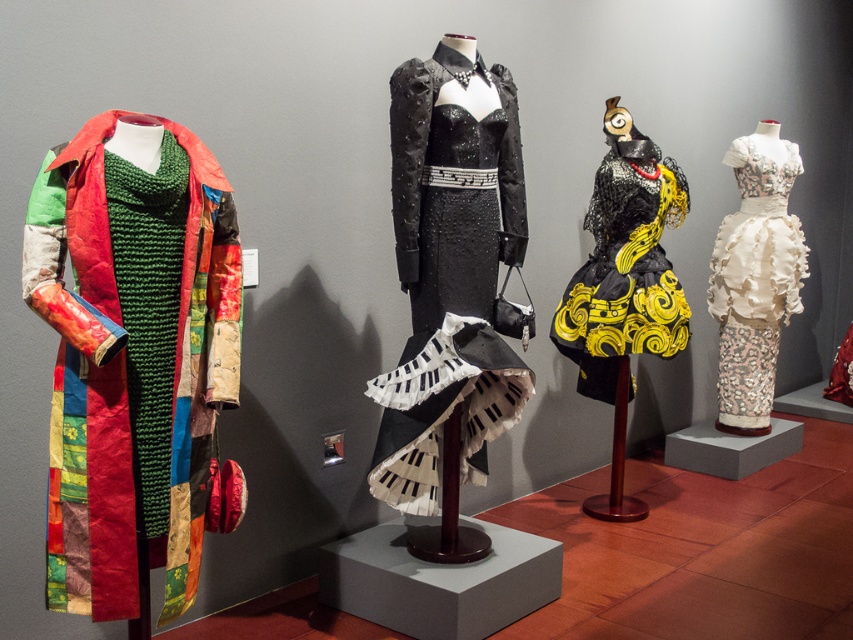
Question: Among these objects, which one is nearest to the camera?

Choices:
 (A) black sequined dress at center
 (B) patchwork fabric coat at left

Answer: (B)

Question: Can you confirm if black textured dress at center is positioned above white lace dress at upper right?

Choices:
 (A) yes
 (B) no

Answer: (B)

Question: Among these points, which one is nearest to the camera?

Choices:
 (A) (155, 522)
 (B) (762, 307)
 (C) (376, 444)
 (D) (592, 280)

Answer: (A)

Question: Does black textured dress at center have a lesser width compared to white lace dress at upper right?

Choices:
 (A) yes
 (B) no

Answer: (B)

Question: Among these objects, which one is farthest from the camera?

Choices:
 (A) patchwork fabric coat at left
 (B) black textured dress at center
 (C) black sequined dress at center
 (D) white lace dress at upper right

Answer: (D)

Question: Can you confirm if black sequined dress at center is thinner than black textured dress at center?

Choices:
 (A) yes
 (B) no

Answer: (A)